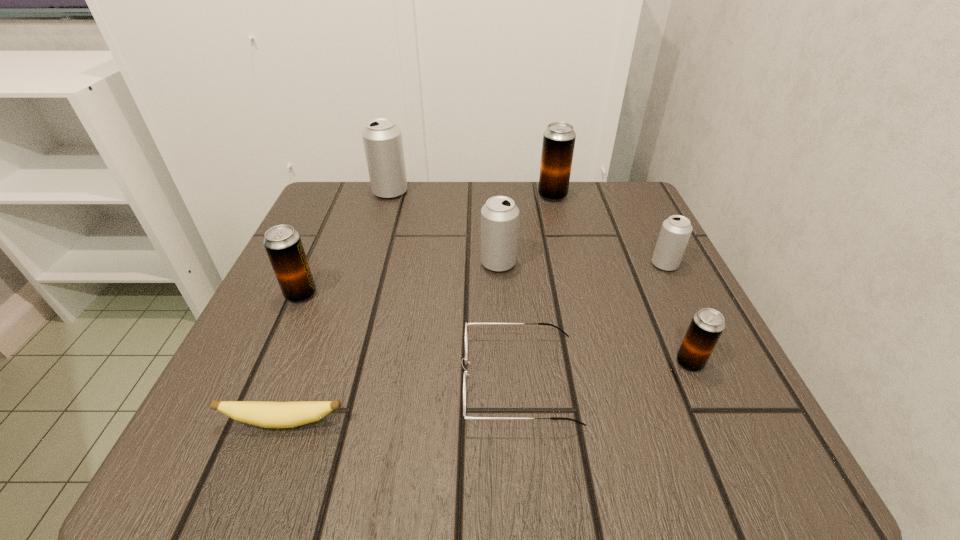
This screenshot has width=960, height=540. I want to click on free space between the second nearest beer can and the second smallest white beer can, so click(399, 279).

The width and height of the screenshot is (960, 540). Find the location of `unoccupied position between the second black beer can from right to left and the second white beer can from left to right`. unoccupied position between the second black beer can from right to left and the second white beer can from left to right is located at coordinates (525, 229).

Where is `free space between the smallest white beer can and the second black beer can from left to right`? The width and height of the screenshot is (960, 540). free space between the smallest white beer can and the second black beer can from left to right is located at coordinates tap(609, 230).

Where is `vacant space in between the leftmost beer can and the rightmost white beer can`? This screenshot has width=960, height=540. vacant space in between the leftmost beer can and the rightmost white beer can is located at coordinates (483, 279).

The image size is (960, 540). In order to click on unoccupied area between the banana and the seventh tallest object in this screenshot , I will do `click(402, 401)`.

Locate an element on the screen. vacant point located between the smallest white beer can and the second smallest white beer can is located at coordinates (582, 264).

Image resolution: width=960 pixels, height=540 pixels. Identify the location of object identified as the second closest to the second white beer can from left to right. (559, 138).

Identify which object is located as the seventh nearest to the nearest black beer can. Please provide its 2D coordinates. Your answer should be formatted as a tuple, i.e. [(x, y)], where the tuple contains the x and y coordinates of a point satisfying the conditions above.

[(382, 138)]

Choose which beer can is the third nearest neighbor to the third beer can from right to left. Please provide its 2D coordinates. Your answer should be formatted as a tuple, i.e. [(x, y)], where the tuple contains the x and y coordinates of a point satisfying the conditions above.

[(382, 138)]

What are the coordinates of `the fourth closest beer can to the rightmost black beer can` in the screenshot? It's located at (283, 244).